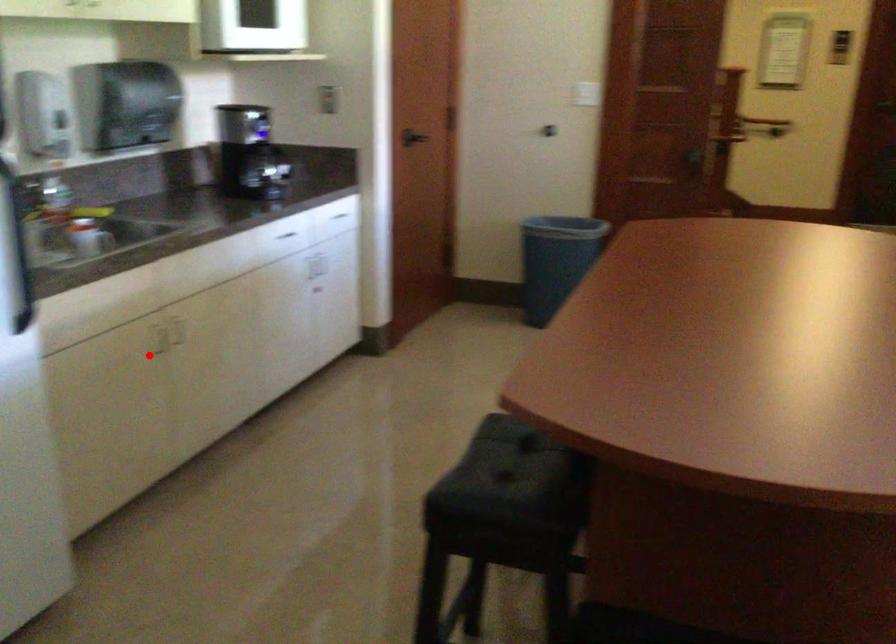
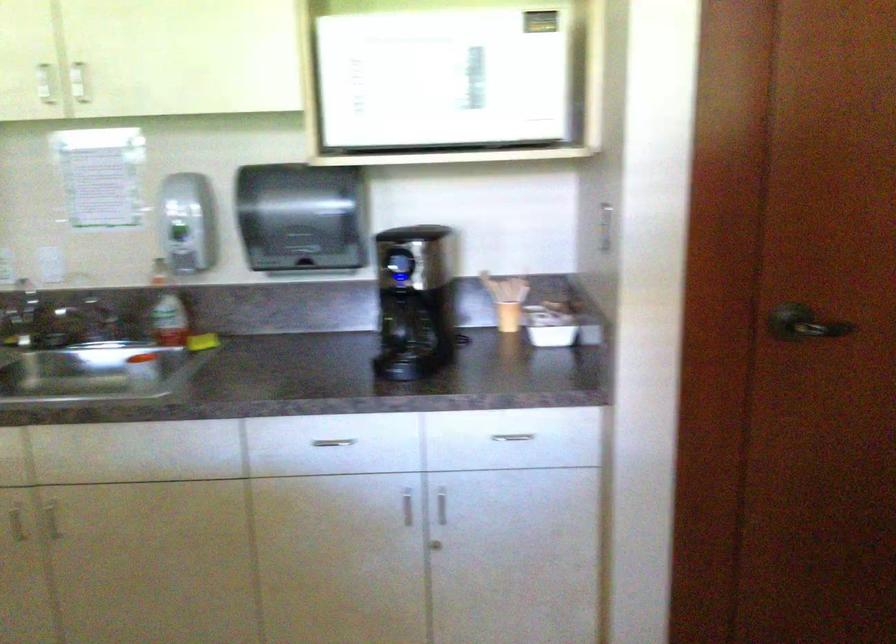
Locate, in the second image, the point that corresponds to the highlighted location in the first image.

(15, 522)